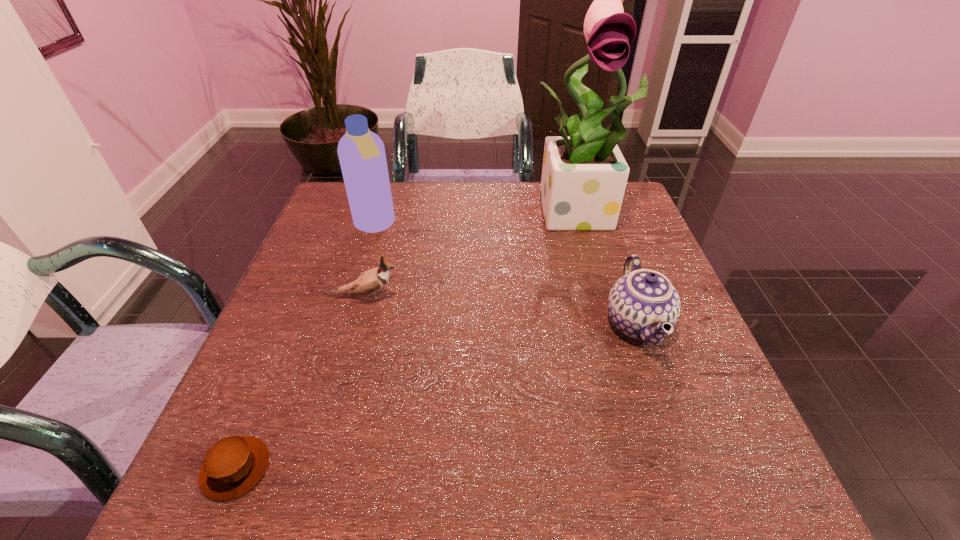
The height and width of the screenshot is (540, 960). Find the location of `free space that is in between the bird and the chinaware`. free space that is in between the bird and the chinaware is located at coordinates (500, 310).

In order to click on vacant point located between the chinaware and the bird in this screenshot , I will do `click(500, 310)`.

Locate an element on the screen. empty space that is in between the bird and the nearest object is located at coordinates 300,382.

I want to click on unoccupied area between the nearest object and the flower arrangement, so click(x=409, y=339).

You are a GUI agent. You are given a task and a screenshot of the screen. Output one action in this format:
    pyautogui.click(x=<x>, y=<y>)
    Task: Click on the vacant point located between the bird and the flower arrangement
    This screenshot has width=960, height=540.
    Given the screenshot: What is the action you would take?
    pyautogui.click(x=472, y=253)

Identify the location of empty space between the bird and the chinaware. Image resolution: width=960 pixels, height=540 pixels. (500, 310).

Where is `vacant point located between the fourth shortest object and the tallest object`? vacant point located between the fourth shortest object and the tallest object is located at coordinates (478, 218).

Locate an element on the screen. This screenshot has width=960, height=540. blank region between the tallest object and the bird is located at coordinates (472, 253).

The width and height of the screenshot is (960, 540). What are the coordinates of `the closest object to the fourth shortest object` in the screenshot? It's located at (372, 280).

Identify which object is located as the second nearest to the flower arrangement. Please provide its 2D coordinates. Your answer should be formatted as a tuple, i.e. [(x, y)], where the tuple contains the x and y coordinates of a point satisfying the conditions above.

[(372, 280)]